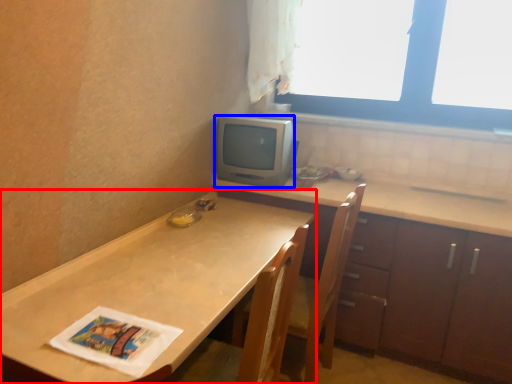
Question: Which point is closer to the camera, countertop (highlighted by a red box) or appliance (highlighted by a blue box)?

Choices:
 (A) countertop
 (B) appliance

Answer: (A)